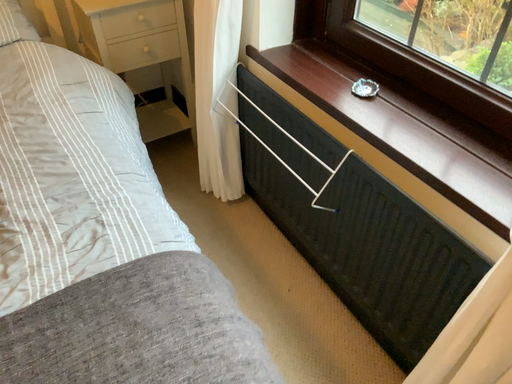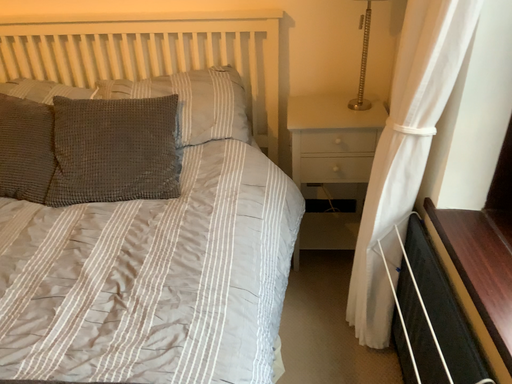
Question: Which way did the camera rotate in the video?

Choices:
 (A) rotated right
 (B) rotated left

Answer: (B)